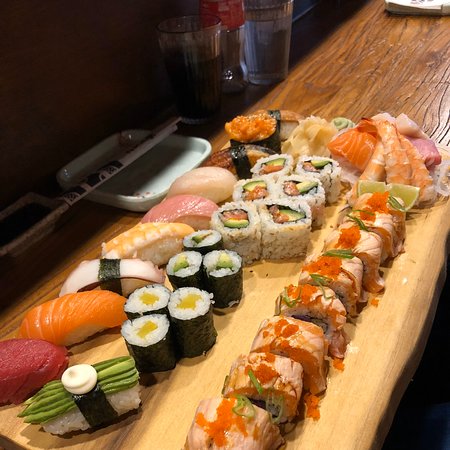
Identify the location of wood board. (330, 418).